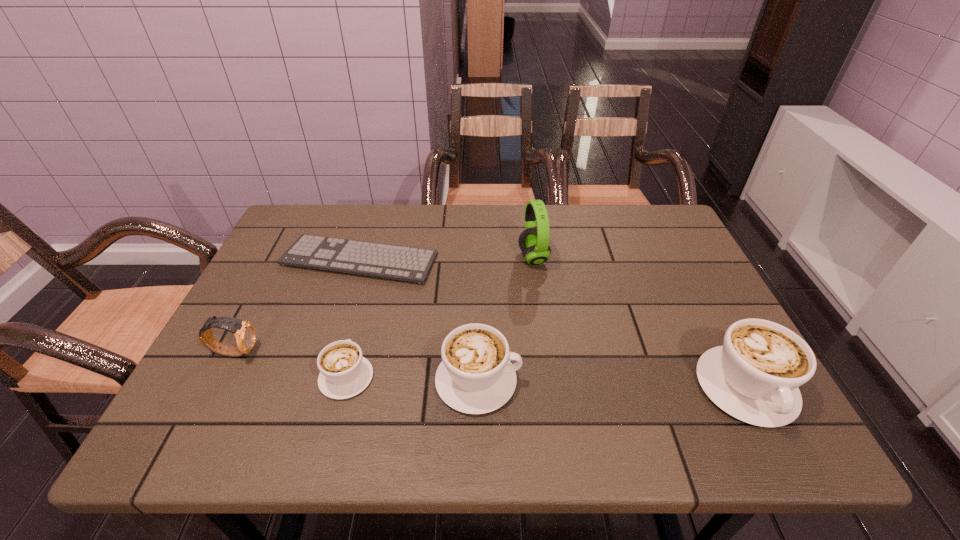
I want to click on the leftmost cappuccino, so click(344, 372).

Locate an element on the screen. The width and height of the screenshot is (960, 540). the fifth tallest object is located at coordinates (344, 372).

The image size is (960, 540). I want to click on the fourth object from left to right, so click(x=475, y=376).

This screenshot has height=540, width=960. In order to click on the second shortest cappuccino in this screenshot , I will do click(475, 376).

At what (x,y) coordinates should I click in order to perform the action: click on the rightmost cappuccino. Please return your answer as a coordinate pair (x, y). Image resolution: width=960 pixels, height=540 pixels. Looking at the image, I should click on (754, 377).

Locate an element on the screen. watch is located at coordinates point(245,333).

Identify the location of the fifth object from left to right. This screenshot has height=540, width=960. (533, 242).

The image size is (960, 540). What are the coordinates of `headset` in the screenshot? It's located at (533, 242).

Where is `computer keyboard`? This screenshot has height=540, width=960. computer keyboard is located at coordinates (403, 263).

Locate an element on the screen. The width and height of the screenshot is (960, 540). vacant space located 0.070m to the right of the leftmost cappuccino's handle is located at coordinates (359, 330).